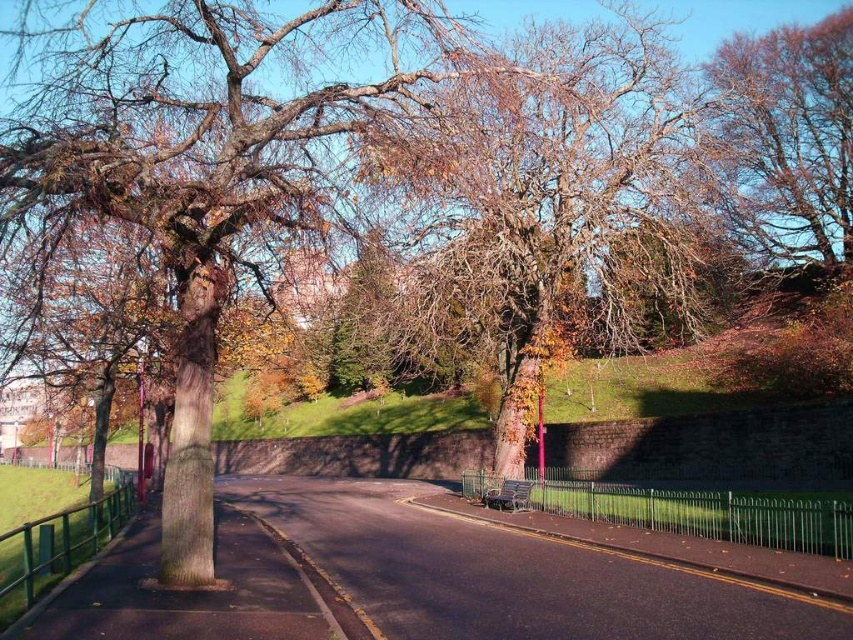
Who is taller, brown rough bark tree at center or brown textured tree at upper right?

brown rough bark tree at center is taller.

Is point (556, 333) closer to viewer compared to point (750, 250)?

Yes.

Find the location of a particular element. The height and width of the screenshot is (640, 853). brown rough bark tree at center is located at coordinates (548, 189).

Is brown rough bark tree at left further to camera compared to brown textured tree at upper right?

No, it is in front of brown textured tree at upper right.

Is point (321, 140) farther from camera compared to point (737, 97)?

No, it is not.

This screenshot has height=640, width=853. What are the coordinates of `brown rough bark tree at left` in the screenshot? It's located at (204, 164).

Between brown rough bark tree at left and brown rough bark tree at center, which one has more height?

Standing taller between the two is brown rough bark tree at center.

Is brown rough bark tree at left behind brown rough bark tree at center?

No, brown rough bark tree at left is in front of brown rough bark tree at center.

Is point (142, 179) farther from viewer compared to point (657, 157)?

No, (142, 179) is in front of (657, 157).

Identify the location of brown rough bark tree at left. The width and height of the screenshot is (853, 640). (204, 164).